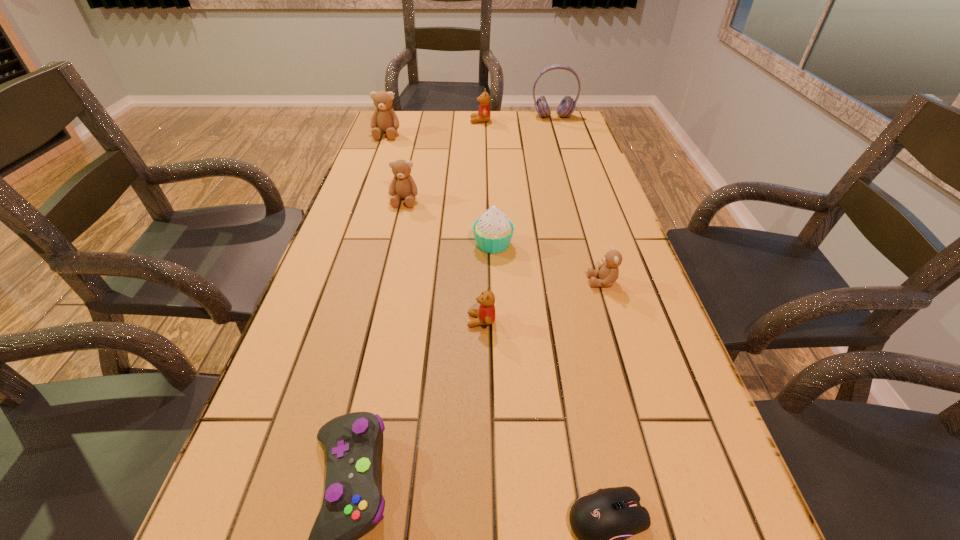
Find the location of `vacant space that is in between the headset and the smaller red teddy bear`. vacant space that is in between the headset and the smaller red teddy bear is located at coordinates coord(517,219).

Identify the location of object that is the fifth closest to the smaller red teddy bear. (403, 186).

This screenshot has width=960, height=540. Find the location of `object that is the sixth closest one to the tallest teddy bear`. object that is the sixth closest one to the tallest teddy bear is located at coordinates (608, 272).

Where is `teddy bear object that ranks as the third closest to the computer mouse`? The height and width of the screenshot is (540, 960). teddy bear object that ranks as the third closest to the computer mouse is located at coordinates (403, 186).

Choose which teddy bear is the fifth nearest neighbor to the white cupcake. Please provide its 2D coordinates. Your answer should be formatted as a tuple, i.e. [(x, y)], where the tuple contains the x and y coordinates of a point satisfying the conditions above.

[(483, 115)]

Find the location of a particular element. The width and height of the screenshot is (960, 540). brown teddy bear that is the second closest to the headset is located at coordinates (403, 186).

Find the location of a particular element. brown teddy bear that is the nearest to the rightmost brown teddy bear is located at coordinates (403, 186).

Where is `blank space that satisfies the following two spatial constraints: 1. on the front-facing side of the bigger red teddy bear; 2. on the front-facing side of the second farthest brown teddy bear`? Image resolution: width=960 pixels, height=540 pixels. blank space that satisfies the following two spatial constraints: 1. on the front-facing side of the bigger red teddy bear; 2. on the front-facing side of the second farthest brown teddy bear is located at coordinates (480, 200).

Identify the location of free space that satisfies the following two spatial constraints: 1. on the headband and ear cups of the headset; 2. on the front-facing side of the rightmost teddy bear. The height and width of the screenshot is (540, 960). (605, 282).

The image size is (960, 540). Identify the location of vacant point that satisfies the following two spatial constraints: 1. on the front-facing side of the cupcake; 2. on the left side of the bigger red teddy bear. (481, 244).